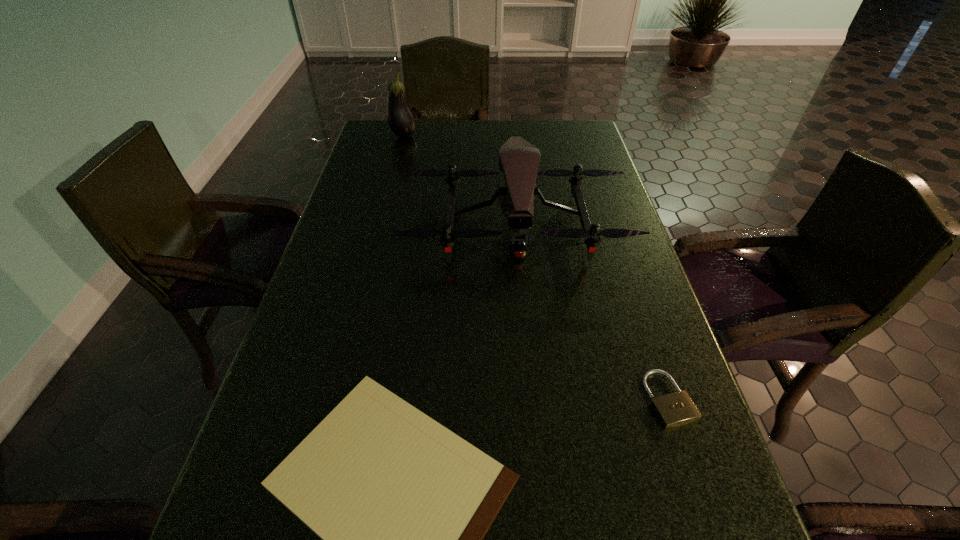
What are the coordinates of `the farthest object` in the screenshot? It's located at (400, 119).

What are the coordinates of `the second farthest object` in the screenshot? It's located at (518, 160).

I want to click on padlock, so click(x=674, y=409).

Identify the location of free space located 0.250m on the right of the eggplant. This screenshot has height=540, width=960. (490, 136).

The image size is (960, 540). Find the location of `free location located on the front-facing side of the third nearest object`. free location located on the front-facing side of the third nearest object is located at coordinates (524, 320).

The image size is (960, 540). What are the coordinates of `vacant region located on the back of the padlock` in the screenshot? It's located at (644, 326).

This screenshot has width=960, height=540. In order to click on object present at the far edge in this screenshot , I will do `click(400, 119)`.

Where is `object positioned at the left edge`? object positioned at the left edge is located at coordinates (400, 119).

You are a GUI agent. You are given a task and a screenshot of the screen. Output one action in this format:
    pyautogui.click(x=<x>, y=<y>)
    Task: Click on the drone that is positioned at the right edge
    Image resolution: width=960 pixels, height=540 pixels.
    Given the screenshot: What is the action you would take?
    pyautogui.click(x=518, y=160)

Find the location of a particular element. padlock that is positioned at the right edge is located at coordinates (674, 409).